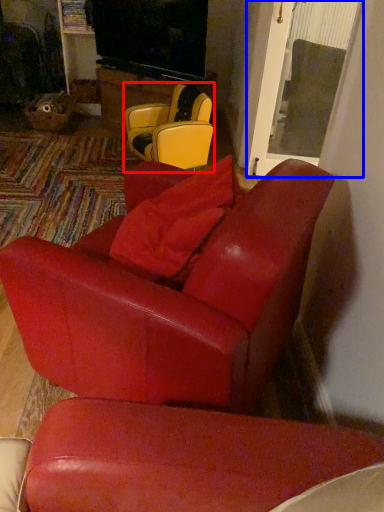
Question: Which object is further to the camera taking this photo, chair (highlighted by a red box) or glass door (highlighted by a blue box)?

Choices:
 (A) chair
 (B) glass door

Answer: (B)